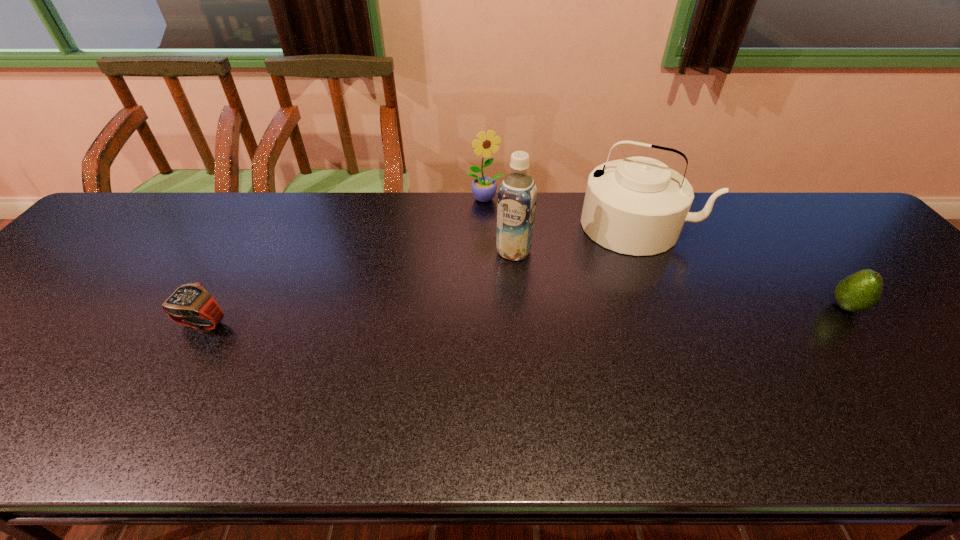
Image resolution: width=960 pixels, height=540 pixels. I want to click on empty location between the rightmost object and the soya milk, so click(x=680, y=279).

Where is `free space between the sunflower and the second object from right to left`? This screenshot has width=960, height=540. free space between the sunflower and the second object from right to left is located at coordinates (562, 212).

This screenshot has height=540, width=960. Identify the location of free space between the kettle and the leftmost object. (420, 274).

This screenshot has height=540, width=960. Identify the location of free space between the second object from right to left and the watch. (420, 274).

Image resolution: width=960 pixels, height=540 pixels. In order to click on free point between the avocado and the shortest object in this screenshot , I will do `click(524, 315)`.

Find the location of `empty space that is in between the sunflower and the shortest object`. empty space that is in between the sunflower and the shortest object is located at coordinates (344, 261).

Point out which object is positioned as the third nearest to the watch. Please provide its 2D coordinates. Your answer should be formatted as a tuple, i.e. [(x, y)], where the tuple contains the x and y coordinates of a point satisfying the conditions above.

[(637, 206)]

At what (x,y) coordinates should I click in order to perform the action: click on object identified as the closest to the watch. Please return your answer as a coordinate pair (x, y). Looking at the image, I should click on (517, 195).

The width and height of the screenshot is (960, 540). I want to click on vacant space that satisfies the following two spatial constraints: 1. on the front side of the second shortest object; 2. on the right side of the soya milk, so click(518, 307).